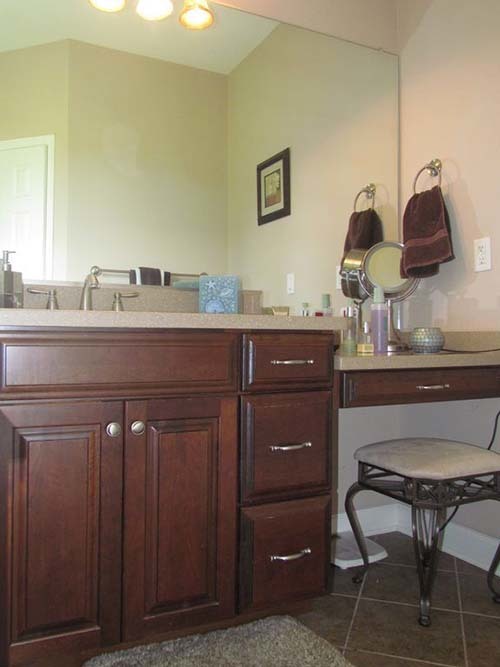
Where is `door`? This screenshot has height=667, width=500. door is located at coordinates (20, 199), (61, 491), (174, 491).